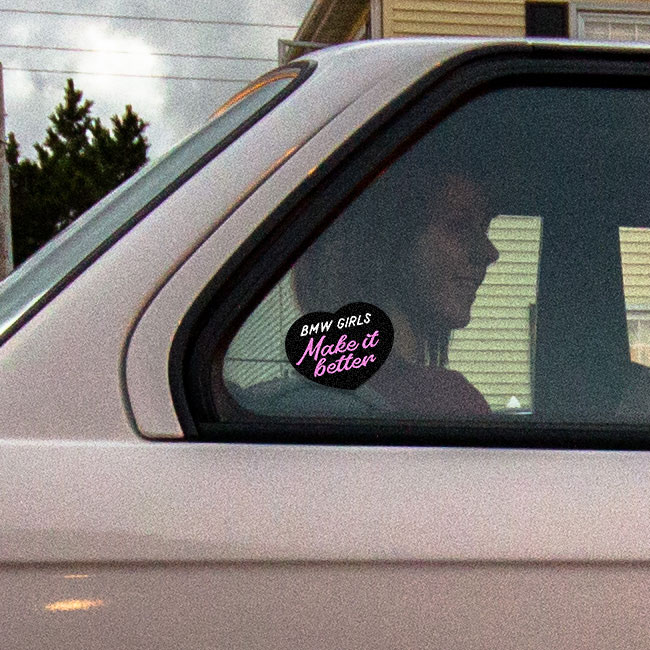
Locate an element on the screen. This screenshot has height=650, width=650. window gasket is located at coordinates (240, 294).